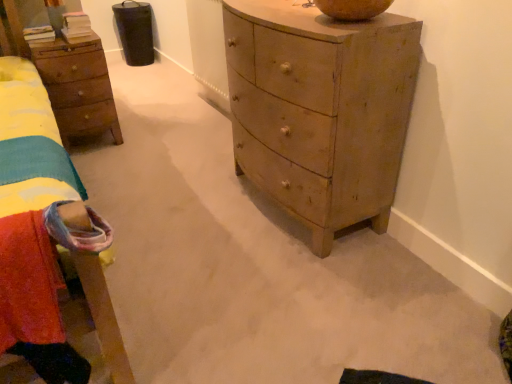
This screenshot has width=512, height=384. What do you see at coordinates (37, 226) in the screenshot?
I see `velvety red blanket at lower left` at bounding box center [37, 226].

This screenshot has height=384, width=512. In order to click on light brown wooden chest of drawers at center in this screenshot , I will do `click(320, 110)`.

From a real-world perspective, relative to velvety red blanket at lower left, is wooden nightstand at left vertically above or below?

wooden nightstand at left is situated lower than velvety red blanket at lower left in the real world.

From the image's perspective, which is above, wooden nightstand at left or velvety red blanket at lower left?

wooden nightstand at left is shown above in the image.

Choose the correct answer: Is wooden nightstand at left inside velvety red blanket at lower left or outside it?

wooden nightstand at left cannot be found inside velvety red blanket at lower left.

Based on the photo, what's the angular difference between wooden nightstand at left and velvety red blanket at lower left's facing directions?

The angular difference between wooden nightstand at left and velvety red blanket at lower left is 1.45 degrees.

Could you tell me if wooden nightstand at left is facing light brown wooden chest of drawers at center?

No, wooden nightstand at left is not turned towards light brown wooden chest of drawers at center.

From the image's perspective, is wooden nightstand at left located above or below light brown wooden chest of drawers at center?

wooden nightstand at left is situated higher than light brown wooden chest of drawers at center in the image.

Considering the positions of objects wooden nightstand at left and light brown wooden chest of drawers at center in the image provided, who is behind, wooden nightstand at left or light brown wooden chest of drawers at center?

wooden nightstand at left is more distant.

Can you confirm if wooden nightstand at left is positioned to the left of light brown wooden chest of drawers at center?

Indeed, wooden nightstand at left is positioned on the left side of light brown wooden chest of drawers at center.

Is the position of velvety red blanket at lower left more distant than that of wooden nightstand at left?

No, the depth of velvety red blanket at lower left is less than that of wooden nightstand at left.

Can you confirm if velvety red blanket at lower left is taller than wooden nightstand at left?

No, velvety red blanket at lower left is not taller than wooden nightstand at left.

Which is nearer, (4, 304) or (87, 124)?

Point (4, 304) is positioned closer to the camera compared to point (87, 124).

Considering the relative sizes of velvety red blanket at lower left and wooden nightstand at left in the image provided, is velvety red blanket at lower left smaller than wooden nightstand at left?

Yes, velvety red blanket at lower left is smaller than wooden nightstand at left.

Is point (45, 99) positioned in front of point (272, 191)?

No, (45, 99) is further to viewer.

Identify the location of chest of drawers behind the velvety red blanket at lower left. The width and height of the screenshot is (512, 384). (320, 110).

Considering the positions of objects velvety red blanket at lower left and light brown wooden chest of drawers at center in the image provided, who is more to the left, velvety red blanket at lower left or light brown wooden chest of drawers at center?

velvety red blanket at lower left is more to the left.

Are light brown wooden chest of drawers at center and wooden nightstand at left located far from each other?

Yes, light brown wooden chest of drawers at center and wooden nightstand at left are located far from each other.

From a real-world perspective, is light brown wooden chest of drawers at center positioned over wooden nightstand at left based on gravity?

Yes, from a real-world perspective, light brown wooden chest of drawers at center is over wooden nightstand at left

Which is less distant, (393, 40) or (52, 82)?

Point (393, 40) appears to be closer to the viewer than point (52, 82).

Which object is closer to the camera taking this photo, light brown wooden chest of drawers at center or wooden nightstand at left?

light brown wooden chest of drawers at center is more forward.

From a real-world perspective, which object rests below the other?

light brown wooden chest of drawers at center is physically lower.

Is the depth of light brown wooden chest of drawers at center less than that of velvety red blanket at lower left?

No.

At what (x,y) coordinates should I click in order to perform the action: click on bed above the wooden nightstand at left (from a real-world perspective). Please return your answer as a coordinate pair (x, y). Looking at the image, I should click on (37, 226).

Where is `nightstand lying behind the light brown wooden chest of drawers at center`? This screenshot has width=512, height=384. nightstand lying behind the light brown wooden chest of drawers at center is located at coordinates (67, 76).

Which object lies nearer to the anchor point velvety red blanket at lower left, wooden nightstand at left or light brown wooden chest of drawers at center?

wooden nightstand at left.

Based on their spatial positions, is velvety red blanket at lower left or wooden nightstand at left closer to light brown wooden chest of drawers at center?

velvety red blanket at lower left is closer to light brown wooden chest of drawers at center.

From the image, which object appears to be farther from wooden nightstand at left, velvety red blanket at lower left or light brown wooden chest of drawers at center?

light brown wooden chest of drawers at center is positioned further to the anchor wooden nightstand at left.

From the image, which object appears to be nearer to light brown wooden chest of drawers at center, wooden nightstand at left or velvety red blanket at lower left?

velvety red blanket at lower left is positioned closer to the anchor light brown wooden chest of drawers at center.

Based on their spatial positions, is light brown wooden chest of drawers at center or wooden nightstand at left closer to velvety red blanket at lower left?

wooden nightstand at left is closer to velvety red blanket at lower left.

Looking at the image, which one is located further to wooden nightstand at left, light brown wooden chest of drawers at center or velvety red blanket at lower left?

Based on the image, light brown wooden chest of drawers at center appears to be further to wooden nightstand at left.

This screenshot has width=512, height=384. Identify the location of chest of drawers between velvety red blanket at lower left and wooden nightstand at left in the front-back direction. (320, 110).